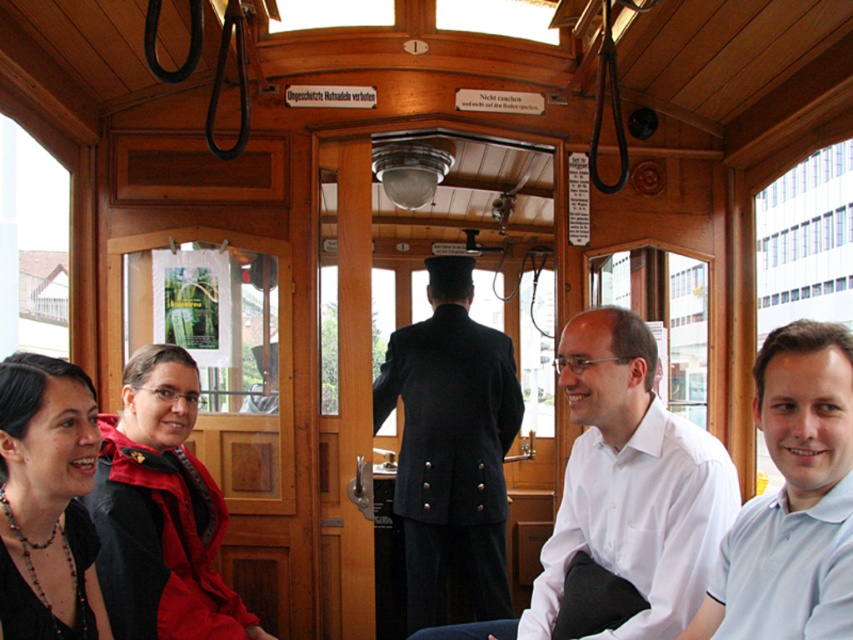
Question: Which of the following is the closest to the observer?

Choices:
 (A) (10, 531)
 (B) (706, 449)
 (C) (722, 547)

Answer: (A)

Question: Considering the real-world distances, which object is closest to the black matte jacket at lower left?

Choices:
 (A) white cotton polo shirt at center
 (B) dark blue uniform at center
 (C) white glossy shirt at center

Answer: (C)

Question: Can you confirm if white glossy shirt at center is positioned below black matte jacket at lower left?

Choices:
 (A) yes
 (B) no

Answer: (A)

Question: Does white glossy shirt at center have a greater width compared to white cotton polo shirt at center?

Choices:
 (A) yes
 (B) no

Answer: (A)

Question: Can you confirm if dark blue uniform at center is smaller than red matte jacket at lower left?

Choices:
 (A) yes
 (B) no

Answer: (B)

Question: Which is nearer to the red matte jacket at lower left?

Choices:
 (A) black matte jacket at lower left
 (B) white glossy shirt at center

Answer: (A)